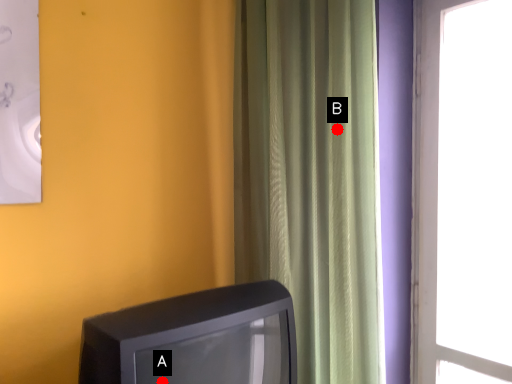
Question: Two points are circled on the image, labeled by A and B beside each circle. Among these points, which one is nearest to the camera?

Choices:
 (A) A is closer
 (B) B is closer

Answer: (A)